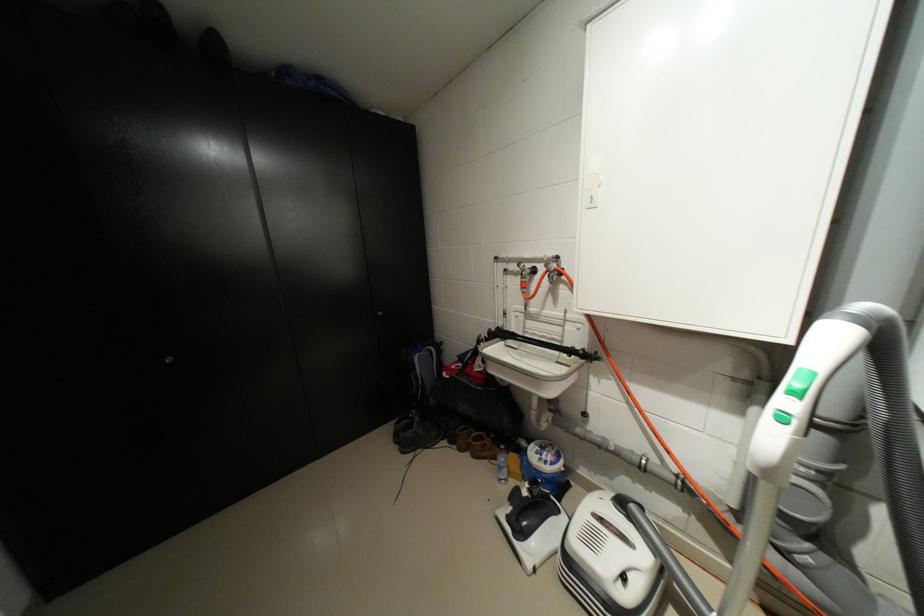
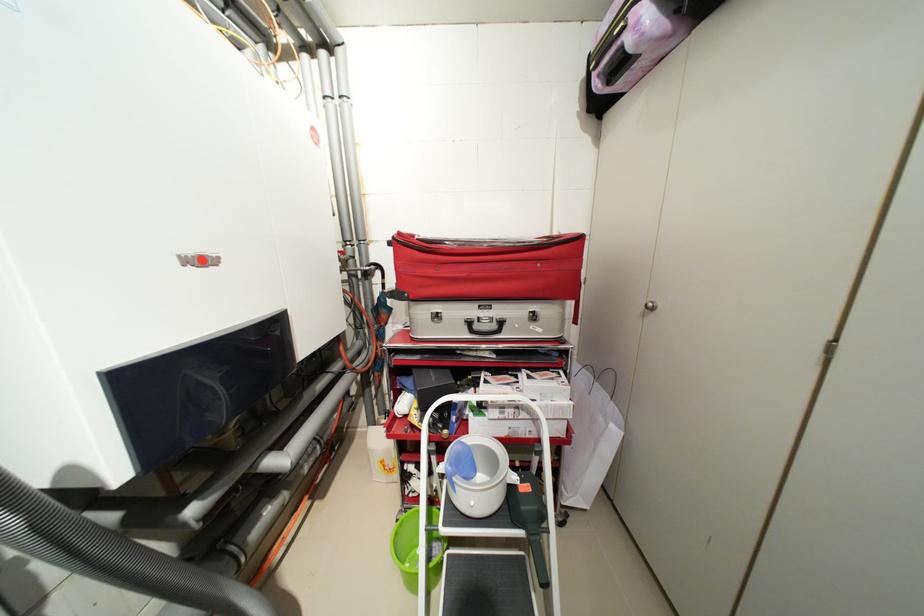
In the second image, find the point that corresponds to point (890, 415) in the first image.

(19, 523)